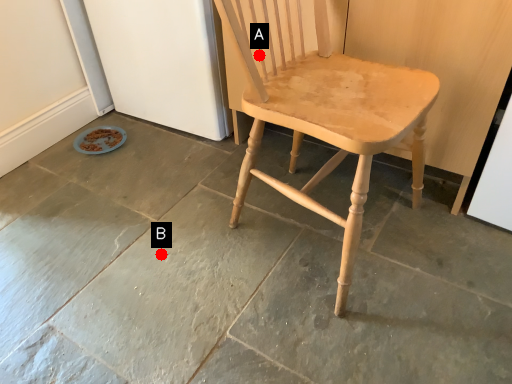
Question: Two points are circled on the image, labeled by A and B beside each circle. Which point is farther from the camera taking this photo?

Choices:
 (A) A is further
 (B) B is further

Answer: (B)